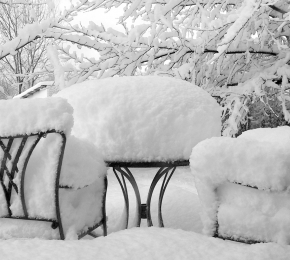
Image resolution: width=290 pixels, height=260 pixels. What are the coordinates of `table legs` in the screenshot? It's located at (158, 205), (149, 207), (140, 205), (128, 205).